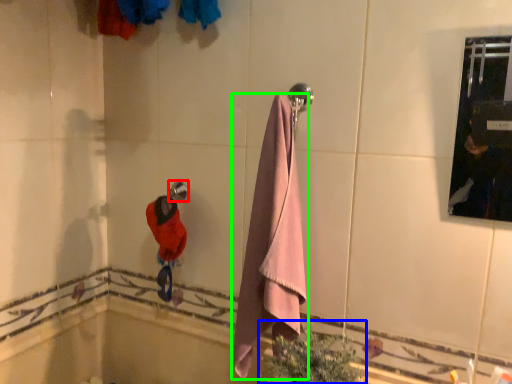
Question: Which object is the farthest from towel bar (highlighted by a red box)? Choose among these: plant (highlighted by a blue box) or towel (highlighted by a green box).

Choices:
 (A) plant
 (B) towel

Answer: (A)